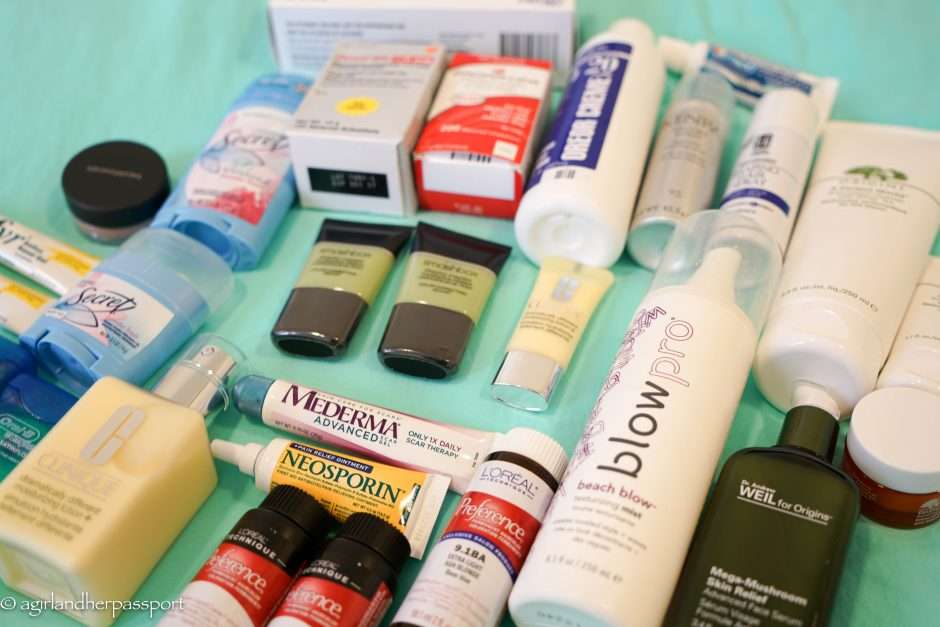
Find the location of a particular element. This screenshot has height=627, width=940. table surface is located at coordinates (154, 88).